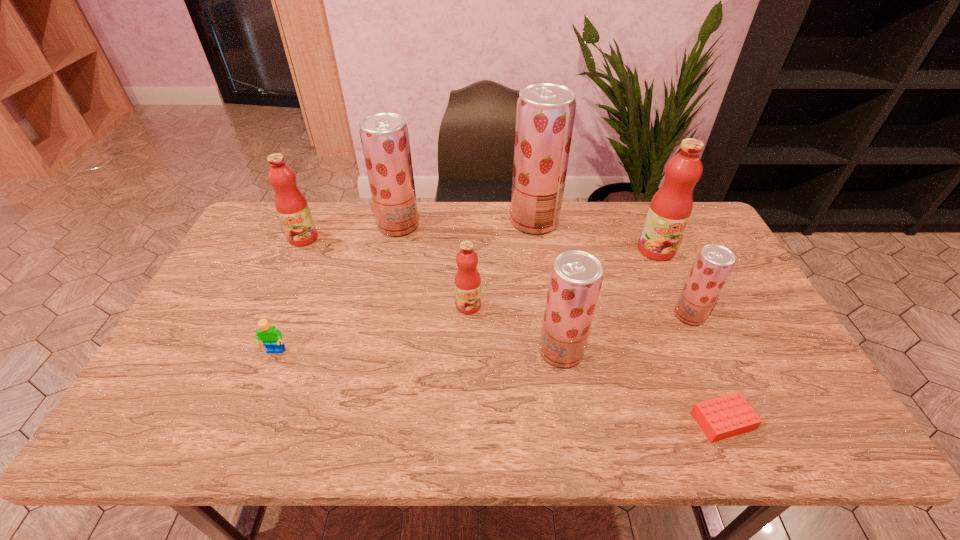
You are a GUI agent. You are given a task and a screenshot of the screen. Output one action in this format:
    pyautogui.click(x=<x>, y=<y>)
    Task: Click on the vacant space located 0.310m on the front label of the second biggest pink fruit juice
    
    Given the screenshot: What is the action you would take?
    pyautogui.click(x=266, y=320)

Find the location of a particular element. This screenshot has width=960, height=540. vacant space located 0.210m on the back of the nearest strawberry fruit juice is located at coordinates (549, 279).

Locate an element on the screen. free region located 0.220m on the left of the second nearest strawberry fruit juice is located at coordinates (595, 315).

Image resolution: width=960 pixels, height=540 pixels. Find the location of `vacant space positioned on the front label of the nearest pink fruit juice`. vacant space positioned on the front label of the nearest pink fruit juice is located at coordinates (468, 341).

Find the location of a particular element. This screenshot has height=540, width=960. vacant area located on the face of the left Lego is located at coordinates (264, 380).

Find the location of a particular element. This screenshot has height=540, width=960. free spot located on the left of the nearest object is located at coordinates (543, 421).

Where is `object situated at the near edge`? The image size is (960, 540). object situated at the near edge is located at coordinates (730, 415).

Image resolution: width=960 pixels, height=540 pixels. In order to click on object at the left edge in this screenshot , I will do `click(292, 207)`.

I want to click on object that is at the right edge, so click(x=670, y=208).

Identify the location of object located in the far left corner section of the desktop. (292, 207).